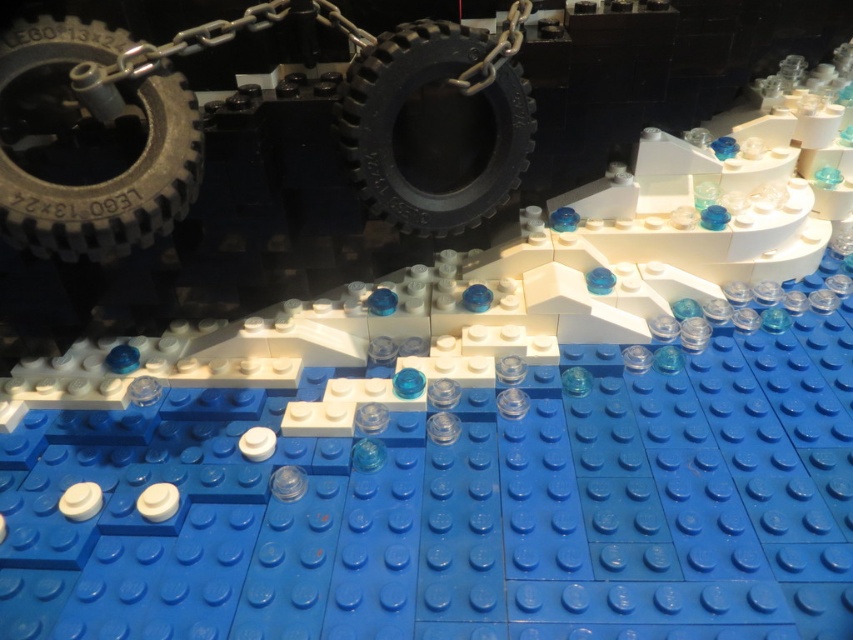
Identify the location of dark gray rubber tire at upper left. (90, 147).

Is point (45, 70) behind point (459, 93)?

No, it is in front of (459, 93).

Where is `dark gray rubber tire at upper left`? dark gray rubber tire at upper left is located at coordinates (90, 147).